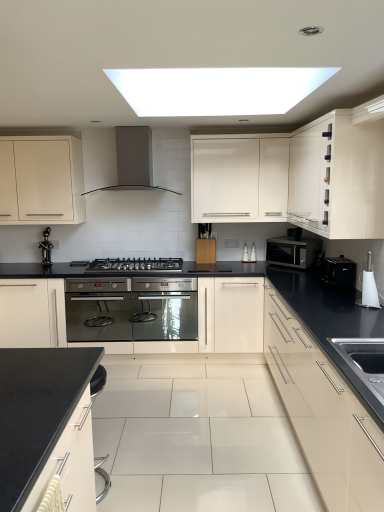
Question: Relative to black matte countertop at lower left, acting as the 4th cabinetry starting from the right, is white glossy toilet brush at right, positioned as the 1th appliance in front-to-back order, in front or behind?

Choices:
 (A) front
 (B) behind

Answer: (B)

Question: Based on their sizes in the image, would you say white glossy toilet brush at right, placed as the 2th appliance when sorted from back to front, is bigger or smaller than black matte countertop at lower left, acting as the 4th cabinetry starting from the right?

Choices:
 (A) big
 (B) small

Answer: (B)

Question: Estimate the real-world distances between objects in this image. Which object is closer to the matte white cabinet at left, the 5th cabinetry in the right-to-left sequence?

Choices:
 (A) black matte faucet at left
 (B) white glossy cabinet at upper right, arranged as the fifth cabinetry when viewed from the left
 (C) satin black microwave at right
 (D) black plastic toaster at right, placed as the second appliance when sorted from front to back
 (E) satin grey metal range hood at upper center

Answer: (E)

Question: Estimate the real-world distances between objects in this image. Which object is closer to the white glossy cabinet at upper center, the third cabinetry in the right-to-left sequence?

Choices:
 (A) white glossy toilet brush at right, positioned as the 1th appliance in front-to-back order
 (B) black matte countertop at lower left, the second cabinetry from the left
 (C) black matte faucet at left
 (D) matte white cabinet at left, the 5th cabinetry in the right-to-left sequence
 (E) glossy cream cabinet at right, the 4th cabinetry when ordered from left to right

Answer: (E)